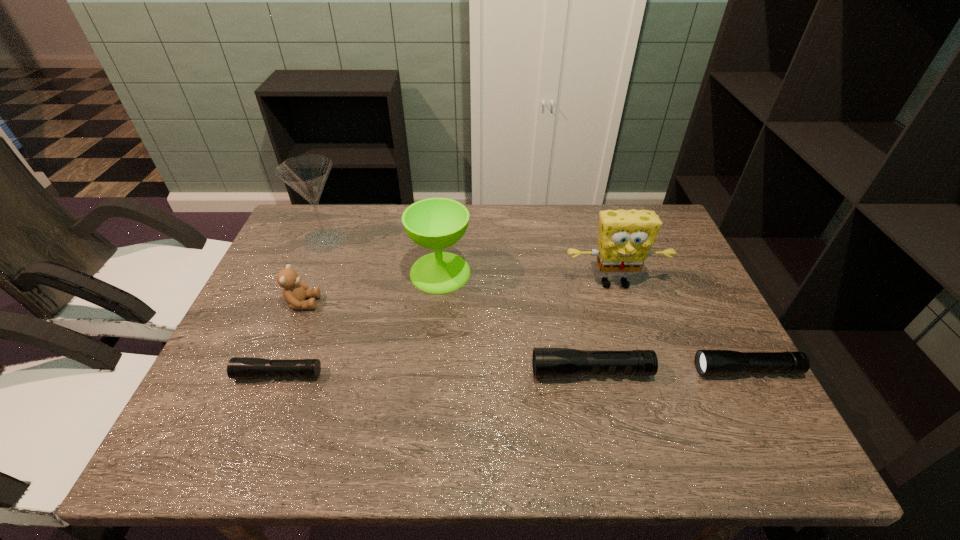
Locate an element on the screen. The width and height of the screenshot is (960, 540). object identified as the fourth closest to the second shortest object is located at coordinates (238, 367).

I want to click on object that is the third closest to the sponge, so click(x=435, y=223).

Image resolution: width=960 pixels, height=540 pixels. In order to click on the closest flashlight to the rightmost flashlight in this screenshot , I will do `click(547, 362)`.

I want to click on flashlight object that ranks as the third closest to the wineglass, so click(x=708, y=362).

Locate an element on the screen. This screenshot has height=540, width=960. vacant space that satisfies the following two spatial constraints: 1. on the face of the sponge; 2. at the lens end of the second flashlight from right to left is located at coordinates (643, 372).

Identify the location of free space that satisfies the following two spatial constraints: 1. on the face of the sponge; 2. at the lens end of the second flashlight from left to right. (643, 372).